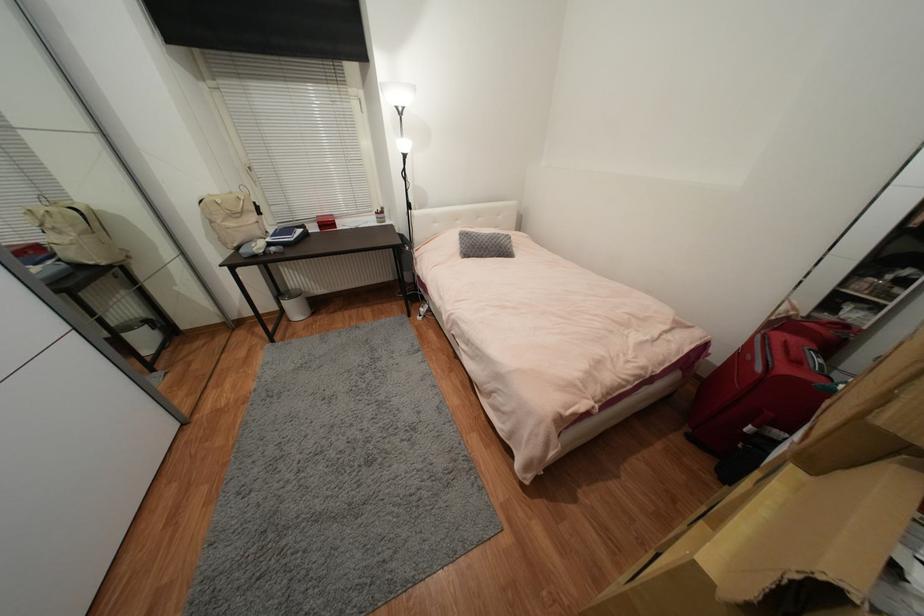
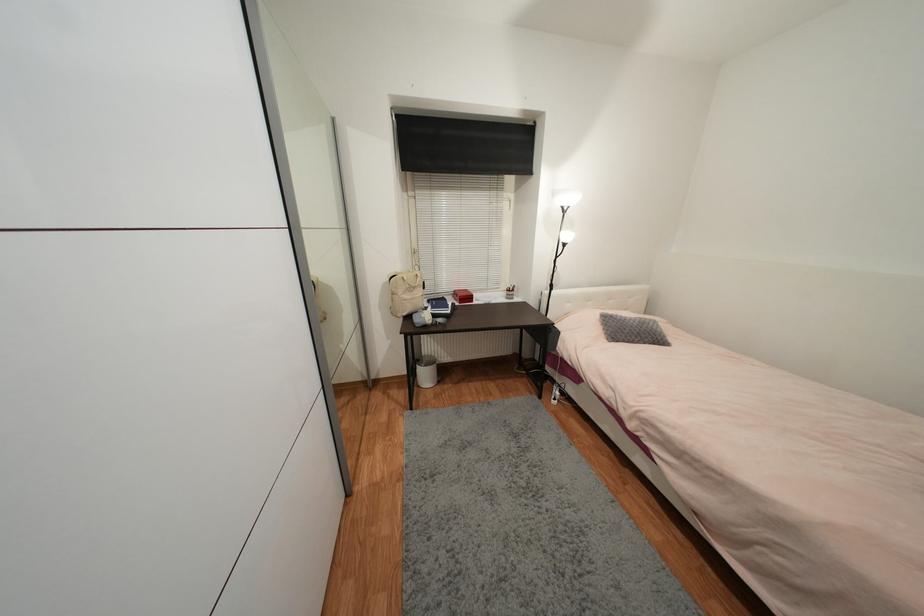
Question: The images are taken continuously from a first-person perspective. In which direction is your viewpoint rotating?

Choices:
 (A) Left
 (B) Right
 (C) Up
 (D) Down

Answer: (C)